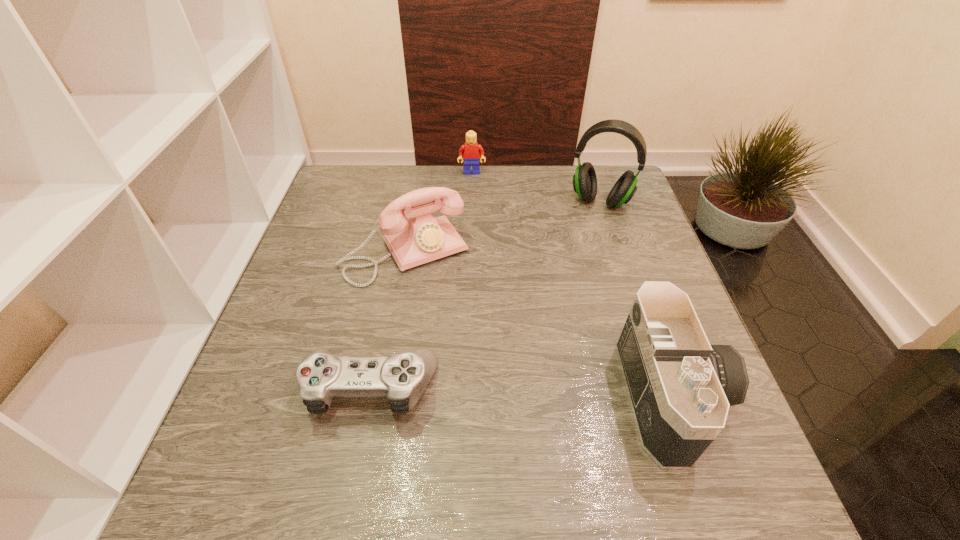
At what (x,y) coordinates should I click in order to perform the action: click on the shortest object. Please return your answer as a coordinate pair (x, y). Image resolution: width=960 pixels, height=540 pixels. Looking at the image, I should click on (403, 377).

You are a GUI agent. You are given a task and a screenshot of the screen. Output one action in this format:
    pyautogui.click(x=<x>, y=<y>)
    Task: Click on the camera
    The height and width of the screenshot is (540, 960).
    Given the screenshot: What is the action you would take?
    pyautogui.click(x=680, y=387)

Locate an element on the screen. Image resolution: width=960 pixels, height=540 pixels. headset is located at coordinates (584, 180).

Identify the location of the fourth nearest object. (584, 180).

Find the location of a particular element. This screenshot has width=960, height=540. the third farthest object is located at coordinates [x=422, y=238].

The height and width of the screenshot is (540, 960). In order to click on the farthest object in this screenshot , I will do `click(471, 151)`.

The height and width of the screenshot is (540, 960). In order to click on the second shortest object in this screenshot , I will do `click(471, 151)`.

You are a GUI agent. You are given a task and a screenshot of the screen. Output one action in this format:
    pyautogui.click(x=<x>, y=<y>)
    Task: Click on the vacant space located on the right of the shortest object
    This screenshot has height=540, width=960.
    Given the screenshot: What is the action you would take?
    pyautogui.click(x=583, y=388)

At what (x,y) coordinates should I click in order to perform the action: click on free space located 0.190m on the ear cups of the headset. Please return your answer as a coordinate pair (x, y). Looking at the image, I should click on (576, 257).

At what (x,y) coordinates should I click in order to perform the action: click on vacant region located 0.300m on the ear cups of the headset. Please return your answer as a coordinate pair (x, y). The image size is (960, 540). Looking at the image, I should click on (565, 287).